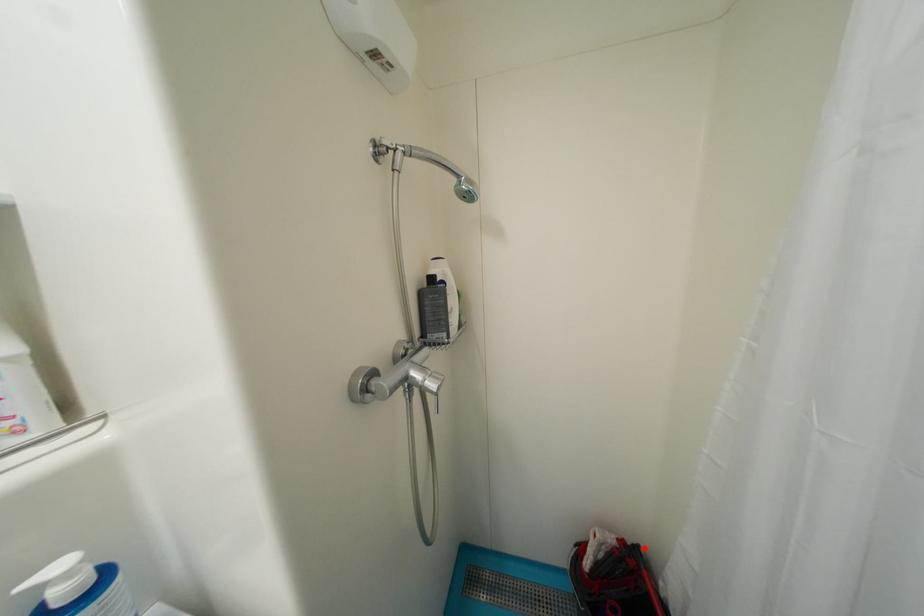
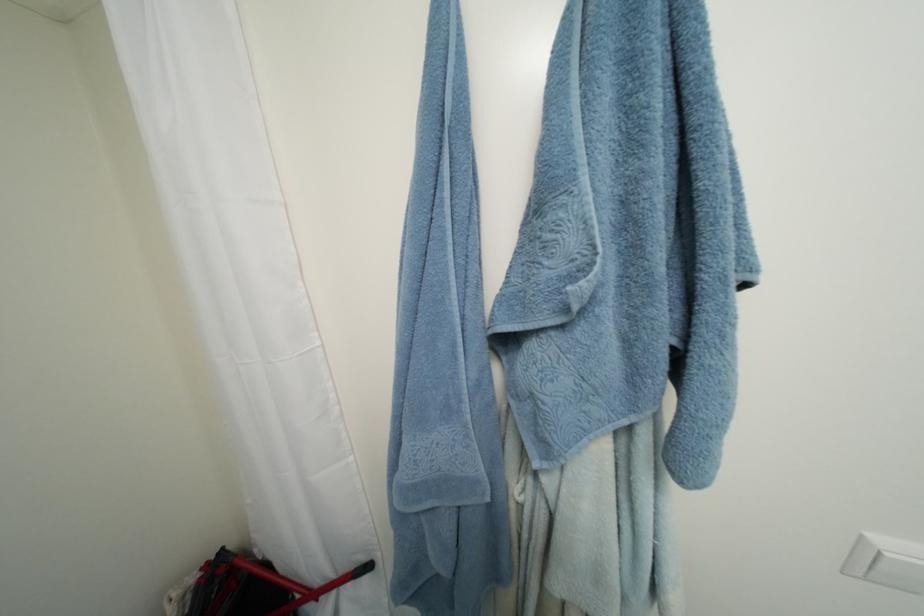
The point at the highlighted location is marked in the first image. Where is the corresponding point in the second image?

(229, 552)